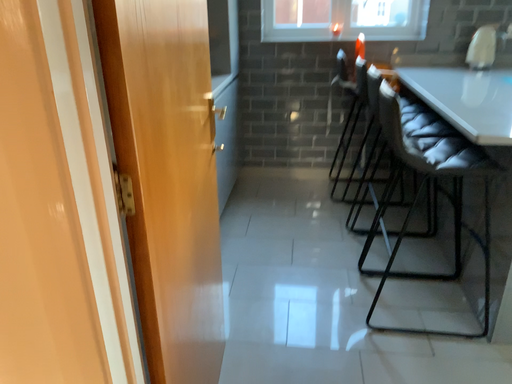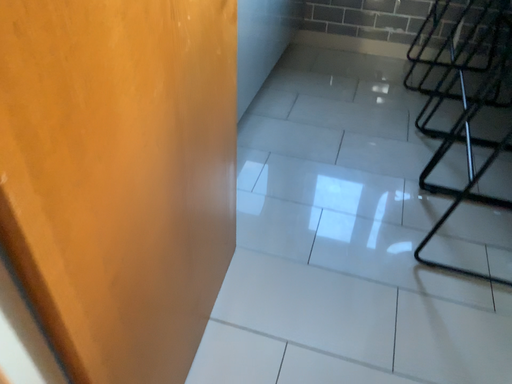
Question: Which way did the camera rotate in the video?

Choices:
 (A) rotated right
 (B) rotated left

Answer: (B)